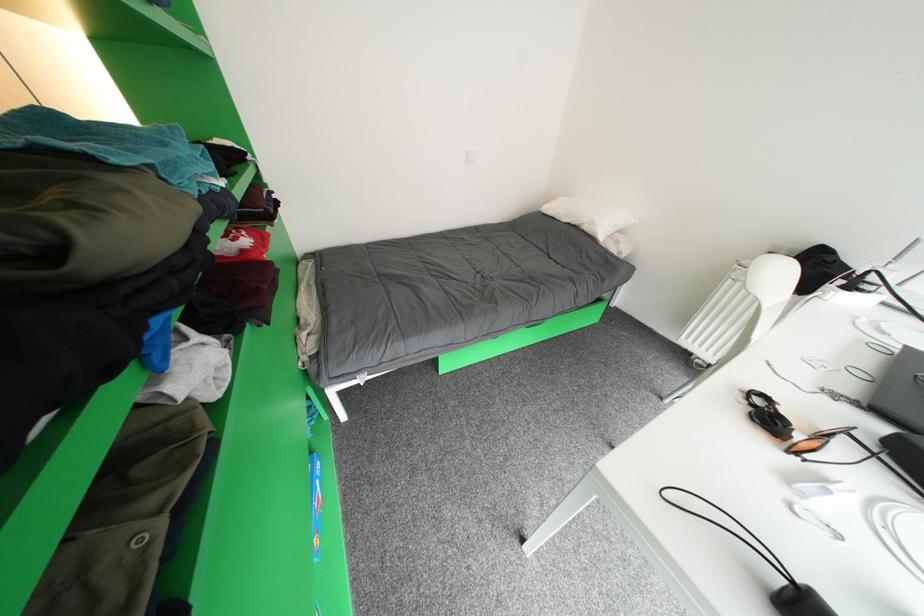
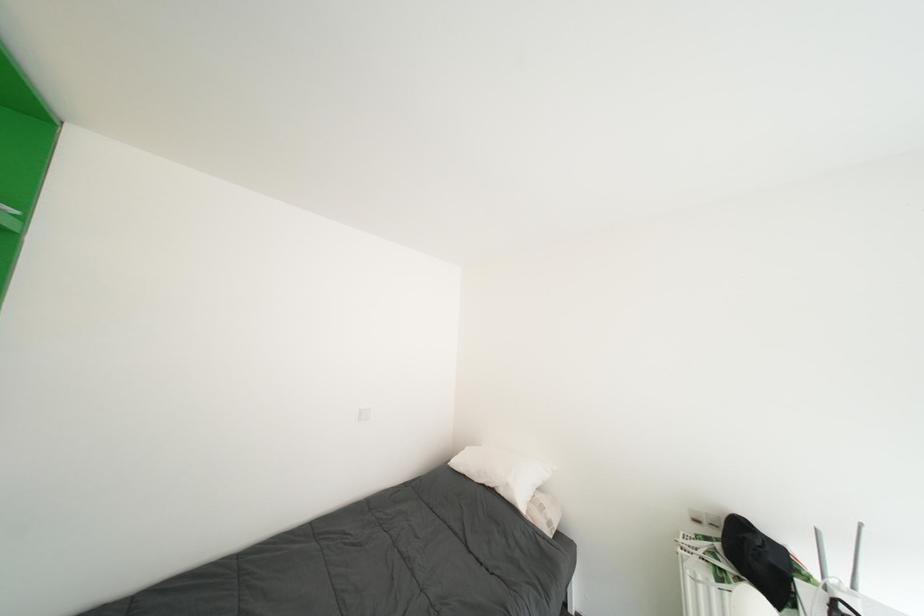
Based on the continuous images, in which direction is the camera rotating?

The camera rotated toward right-up.